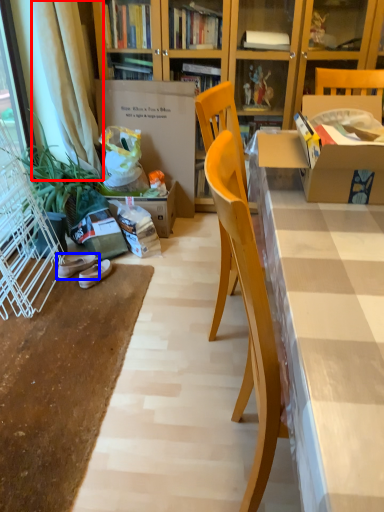
Question: Which object is closer to the camera taking this photo, curtain (highlighted by a red box) or footwear (highlighted by a blue box)?

Choices:
 (A) curtain
 (B) footwear

Answer: (A)